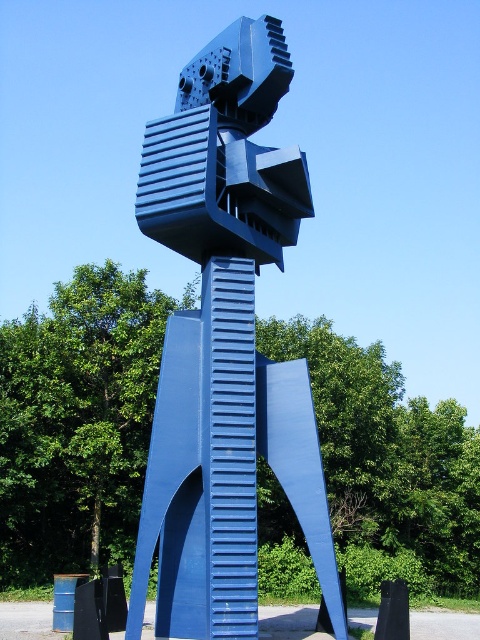
You are standing at the origin point in a park and see the blue metallic sculpture at center. What are the coordinates of the sculpture?

The coordinates of the blue metallic sculpture at center are at point (78, 420).

You are standing in a park and see the sculpture. You want to take a photo of the sculpture from a position that is exactly 25 meters away from the point at coordinates point (49, 408). Is this possible?

The distance of point (49, 408) from camera is 26.95 meters. Since you want to be exactly 25 meters away from the point, you need to move 1.95 meters closer to the point to reach the desired distance.

Based on the photo, you are an artist planning to photograph the blue metallic sculpture at center and the metallic blue sculpture at center from a distance. Which sculpture will appear larger in the photo if you take it from the same spot?

The blue metallic sculpture at center is much taller than the metallic blue sculpture at center, so it will appear larger in the photo.